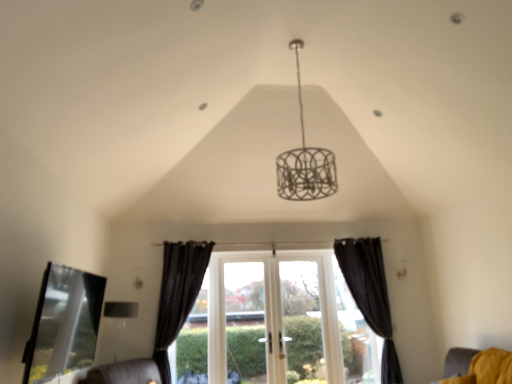
Question: From a real-world perspective, is white wood window at center beneath transparent glass bay window at lower left?

Choices:
 (A) yes
 (B) no

Answer: (A)

Question: Is white wood window at center thinner than transparent glass bay window at lower left?

Choices:
 (A) no
 (B) yes

Answer: (B)

Question: Does white wood window at center appear on the left side of transparent glass bay window at lower left?

Choices:
 (A) yes
 (B) no

Answer: (B)

Question: From the image's perspective, is white wood window at center beneath transparent glass bay window at lower left?

Choices:
 (A) no
 (B) yes

Answer: (B)

Question: From a real-world perspective, is white wood window at center located higher than transparent glass bay window at lower left?

Choices:
 (A) no
 (B) yes

Answer: (A)

Question: Considering the relative positions of matte silver lampshade at lower left and yellow fabric cushion at lower right in the image provided, is matte silver lampshade at lower left to the left or to the right of yellow fabric cushion at lower right?

Choices:
 (A) right
 (B) left

Answer: (B)

Question: Looking at the image, does matte silver lampshade at lower left seem bigger or smaller compared to yellow fabric cushion at lower right?

Choices:
 (A) small
 (B) big

Answer: (B)

Question: In terms of width, does matte silver lampshade at lower left look wider or thinner when compared to yellow fabric cushion at lower right?

Choices:
 (A) wide
 (B) thin

Answer: (B)

Question: Is matte silver lampshade at lower left situated inside yellow fabric cushion at lower right or outside?

Choices:
 (A) inside
 (B) outside

Answer: (B)

Question: From the image's perspective, relative to white glass screen door at center, is transparent glass bay window at lower left above or below?

Choices:
 (A) above
 (B) below

Answer: (A)

Question: Considering the relative positions of transparent glass bay window at lower left and white glass screen door at center in the image provided, is transparent glass bay window at lower left to the left or to the right of white glass screen door at center?

Choices:
 (A) right
 (B) left

Answer: (B)

Question: Relative to white glass screen door at center, is transparent glass bay window at lower left in front or behind?

Choices:
 (A) front
 (B) behind

Answer: (A)

Question: Is point click(89, 340) positioned closer to the camera than point click(303, 264)?

Choices:
 (A) closer
 (B) farther

Answer: (A)

Question: Would you say black matte curtain at right, which is the 1th curtain from right to left, is to the left or to the right of matte silver lampshade at lower left in the picture?

Choices:
 (A) right
 (B) left

Answer: (A)

Question: Considering the positions of point (390, 372) and point (117, 322), is point (390, 372) closer or farther from the camera than point (117, 322)?

Choices:
 (A) farther
 (B) closer

Answer: (A)